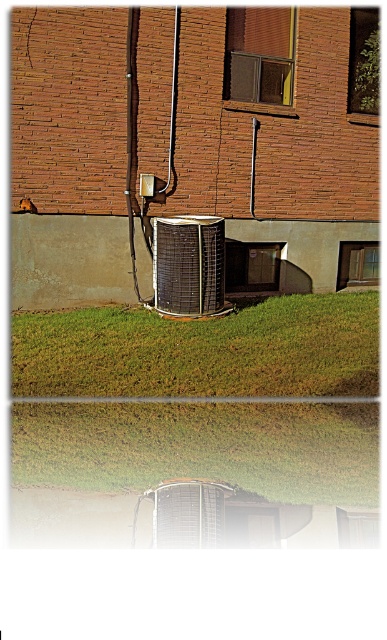
Question: Among these objects, which one is farthest from the camera?

Choices:
 (A) green grass at lower center
 (B) metallic grid air conditioner at center

Answer: (B)

Question: Does green grass at lower center have a greater width compared to metallic grid air conditioner at center?

Choices:
 (A) yes
 (B) no

Answer: (A)

Question: Can you confirm if green grass at lower center is smaller than metallic grid air conditioner at center?

Choices:
 (A) yes
 (B) no

Answer: (B)

Question: Which point is closer to the camera?

Choices:
 (A) (246, 340)
 (B) (214, 273)

Answer: (A)

Question: Among these objects, which one is nearest to the camera?

Choices:
 (A) green grass at lower center
 (B) metallic grid air conditioner at center

Answer: (A)

Question: Can you confirm if green grass at lower center is bigger than metallic grid air conditioner at center?

Choices:
 (A) no
 (B) yes

Answer: (B)